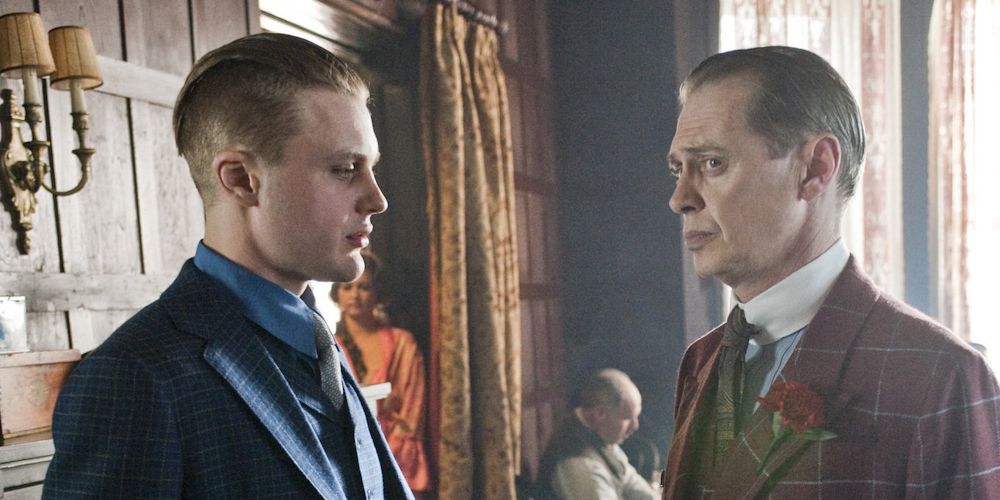
This screenshot has width=1000, height=500. Find the location of `lampshade`. lampshade is located at coordinates (39, 29), (72, 41).